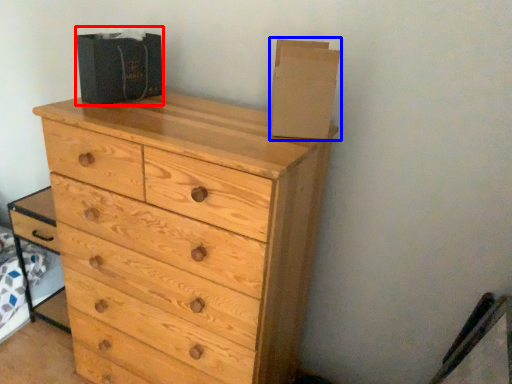
Question: Which object appears farthest to the camera in this image, cardboard box (highlighted by a red box) or cardboard box (highlighted by a blue box)?

Choices:
 (A) cardboard box
 (B) cardboard box

Answer: (A)